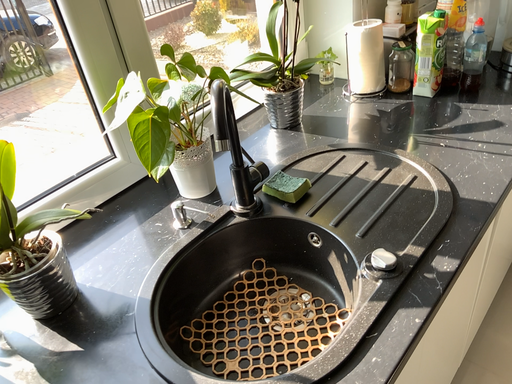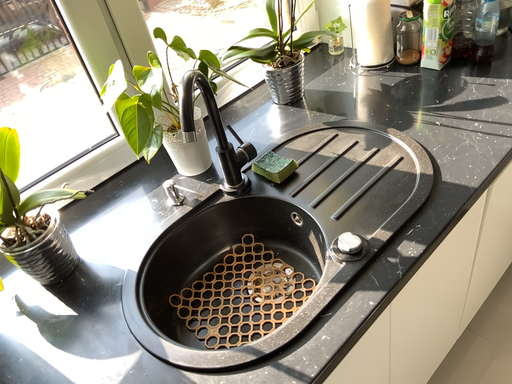
Question: Which way did the camera rotate in the video?

Choices:
 (A) rotated left
 (B) rotated right

Answer: (A)